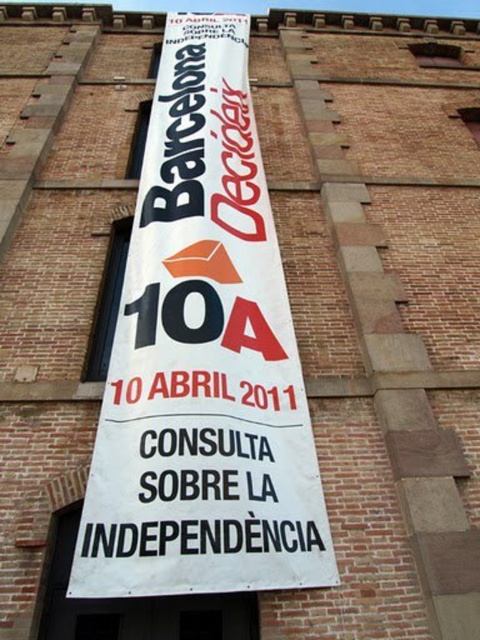
Does white paper banner at center appear on the right side of black paper text at center?

In fact, white paper banner at center is to the left of black paper text at center.

Between white paper banner at center and black paper text at center, which one appears on the left side from the viewer's perspective?

white paper banner at center

You are a GUI agent. You are given a task and a screenshot of the screen. Output one action in this format:
    pyautogui.click(x=<x>, y=<y>)
    Task: Click on the white paper banner at center
    
    Given the screenshot: What is the action you would take?
    pyautogui.click(x=203, y=358)